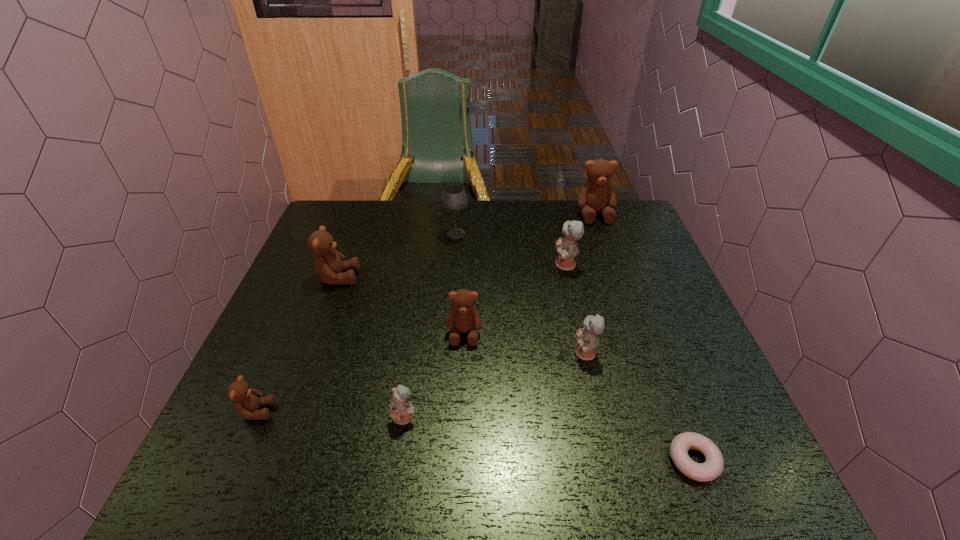
Image resolution: width=960 pixels, height=540 pixels. I want to click on the nearest blue teddy bear, so point(401,410).

I want to click on the smallest blue teddy bear, so click(x=401, y=410).

At what (x,y) coordinates should I click in order to perform the action: click on the shortest object. Please return your answer as a coordinate pair (x, y). The image size is (960, 540). Looking at the image, I should click on (713, 466).

At what (x,y) coordinates should I click in order to perform the action: click on doughnut. Please return your answer as a coordinate pair (x, y). The width and height of the screenshot is (960, 540). Looking at the image, I should click on (713, 466).

The height and width of the screenshot is (540, 960). Identify the location of vacant space located on the face of the farthest brown teddy bear. (611, 261).

Find the location of `free space located on the right of the gray wineglass`. free space located on the right of the gray wineglass is located at coordinates (485, 234).

Locate an element on the screen. The image size is (960, 540). blank space located 0.370m on the front-facing side of the biggest blue teddy bear is located at coordinates (423, 265).

I want to click on vacant area situated on the front-facing side of the biggest blue teddy bear, so click(501, 265).

The height and width of the screenshot is (540, 960). I want to click on vacant space located on the front-facing side of the biggest blue teddy bear, so click(x=469, y=265).

At what (x,y) coordinates should I click in order to perform the action: click on free space located on the face of the second biggest brown teddy bear. Please return your answer as a coordinate pair (x, y). Looking at the image, I should click on (435, 277).